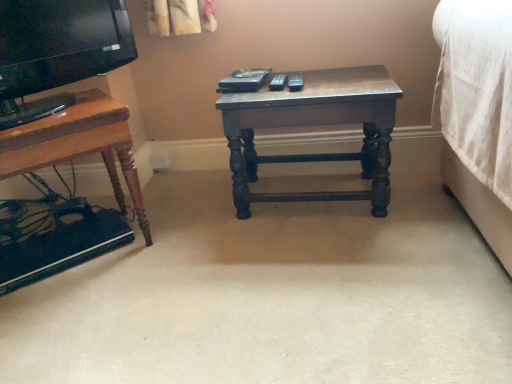
Question: From the image's perspective, is dark wood table at center, marked as the first table in a right-to-left arrangement, on wooden table at left, placed as the second table when sorted from right to left?

Choices:
 (A) yes
 (B) no

Answer: (A)

Question: Can you confirm if dark wood table at center, the 2th table when ordered from left to right, is thinner than wooden table at left, placed as the second table when sorted from right to left?

Choices:
 (A) no
 (B) yes

Answer: (B)

Question: Does dark wood table at center, the 2th table when ordered from left to right, have a larger size compared to wooden table at left, placed as the second table when sorted from right to left?

Choices:
 (A) no
 (B) yes

Answer: (A)

Question: Does dark wood table at center, marked as the first table in a right-to-left arrangement, turn towards wooden table at left, placed as the second table when sorted from right to left?

Choices:
 (A) yes
 (B) no

Answer: (B)

Question: Does dark wood table at center, the 2th table when ordered from left to right, come in front of wooden table at left, placed as the second table when sorted from right to left?

Choices:
 (A) no
 (B) yes

Answer: (A)

Question: Is dark wood table at center, the 2th table when ordered from left to right, facing away from wooden table at left, the first table from the left?

Choices:
 (A) no
 (B) yes

Answer: (A)

Question: Is the position of wooden table at left, the first table from the left, more distant than that of dark wood table at center, the 2th table when ordered from left to right?

Choices:
 (A) no
 (B) yes

Answer: (A)

Question: Considering the relative sizes of wooden table at left, placed as the second table when sorted from right to left, and dark wood table at center, marked as the first table in a right-to-left arrangement, in the image provided, is wooden table at left, placed as the second table when sorted from right to left, taller than dark wood table at center, marked as the first table in a right-to-left arrangement,?

Choices:
 (A) no
 (B) yes

Answer: (B)

Question: Does wooden table at left, the first table from the left, appear on the right side of dark wood table at center, marked as the first table in a right-to-left arrangement?

Choices:
 (A) yes
 (B) no

Answer: (B)

Question: Can you confirm if wooden table at left, placed as the second table when sorted from right to left, is bigger than dark wood table at center, the 2th table when ordered from left to right?

Choices:
 (A) no
 (B) yes

Answer: (B)

Question: From a real-world perspective, is wooden table at left, the first table from the left, positioned under dark wood table at center, marked as the first table in a right-to-left arrangement, based on gravity?

Choices:
 (A) no
 (B) yes

Answer: (A)

Question: Is dark wood table at center, the 2th table when ordered from left to right, located within wooden table at left, placed as the second table when sorted from right to left?

Choices:
 (A) no
 (B) yes

Answer: (A)

Question: Is point (118, 226) closer or farther from the camera than point (303, 158)?

Choices:
 (A) farther
 (B) closer

Answer: (B)